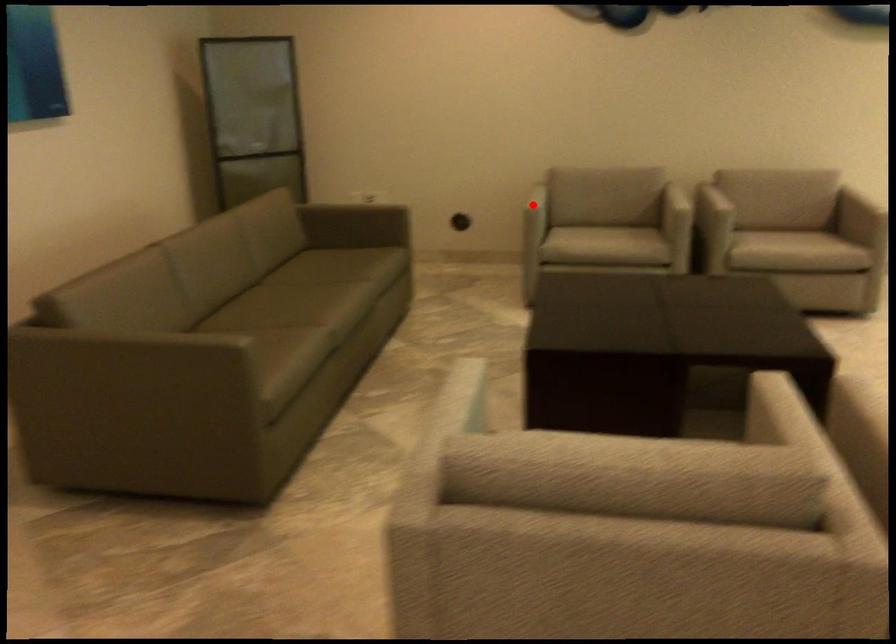
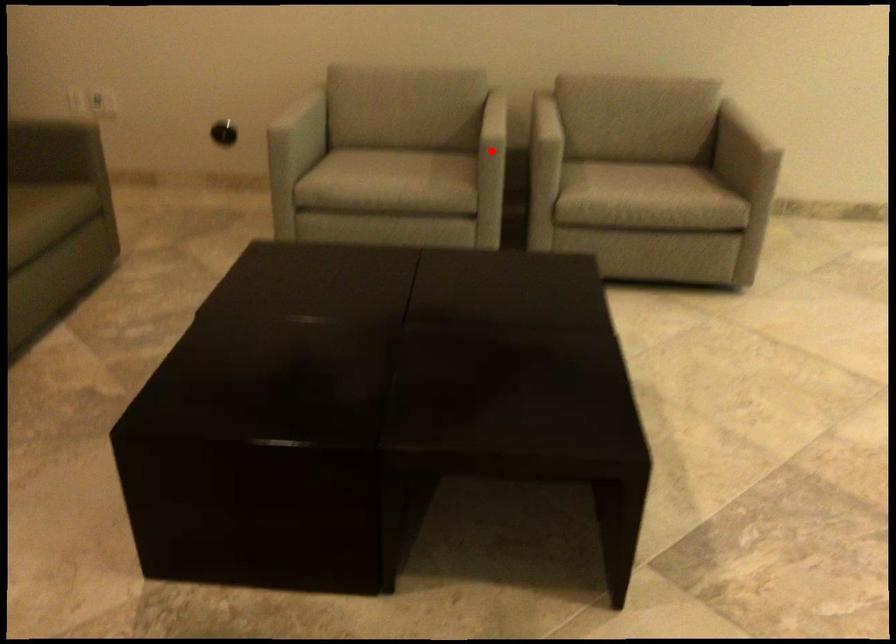
I am providing you with two images of the same scene from different viewpoints. A red point is marked on the first image and another point is marked on the second image. Are the points marked in image1 and image2 representing the same 3D position?

No